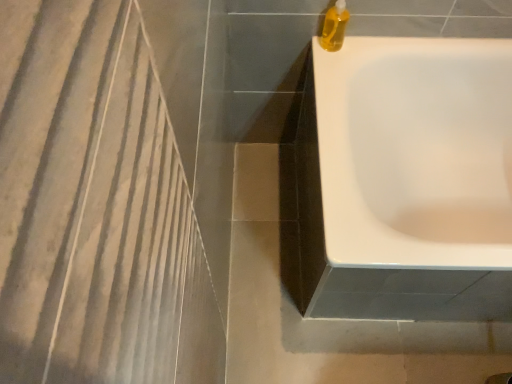
Question: Considering the relative sizes of translucent yellow liquid at top right and white glossy bathtub at upper right in the image provided, is translucent yellow liquid at top right wider than white glossy bathtub at upper right?

Choices:
 (A) no
 (B) yes

Answer: (A)

Question: Considering the relative sizes of translucent yellow liquid at top right and white glossy bathtub at upper right in the image provided, is translucent yellow liquid at top right bigger than white glossy bathtub at upper right?

Choices:
 (A) no
 (B) yes

Answer: (A)

Question: Is white glossy bathtub at upper right a part of translucent yellow liquid at top right?

Choices:
 (A) yes
 (B) no

Answer: (B)

Question: Considering the relative sizes of translucent yellow liquid at top right and white glossy bathtub at upper right in the image provided, is translucent yellow liquid at top right smaller than white glossy bathtub at upper right?

Choices:
 (A) no
 (B) yes

Answer: (B)

Question: Does translucent yellow liquid at top right lie behind white glossy bathtub at upper right?

Choices:
 (A) no
 (B) yes

Answer: (B)

Question: Can you confirm if translucent yellow liquid at top right is positioned to the right of white glossy bathtub at upper right?

Choices:
 (A) no
 (B) yes

Answer: (A)

Question: Does white glossy bathtub at upper right have a smaller size compared to translucent yellow liquid at top right?

Choices:
 (A) no
 (B) yes

Answer: (A)

Question: Can you confirm if white glossy bathtub at upper right is shorter than translucent yellow liquid at top right?

Choices:
 (A) yes
 (B) no

Answer: (B)

Question: Does white glossy bathtub at upper right come in front of translucent yellow liquid at top right?

Choices:
 (A) no
 (B) yes

Answer: (B)

Question: Considering the relative positions of white glossy bathtub at upper right and translucent yellow liquid at top right in the image provided, is white glossy bathtub at upper right to the right of translucent yellow liquid at top right from the viewer's perspective?

Choices:
 (A) yes
 (B) no

Answer: (A)

Question: Could you tell me if white glossy bathtub at upper right is turned towards translucent yellow liquid at top right?

Choices:
 (A) yes
 (B) no

Answer: (B)

Question: Is white glossy bathtub at upper right in contact with translucent yellow liquid at top right?

Choices:
 (A) no
 (B) yes

Answer: (A)

Question: Based on their positions, is translucent yellow liquid at top right located to the left or right of white glossy bathtub at upper right?

Choices:
 (A) right
 (B) left

Answer: (B)